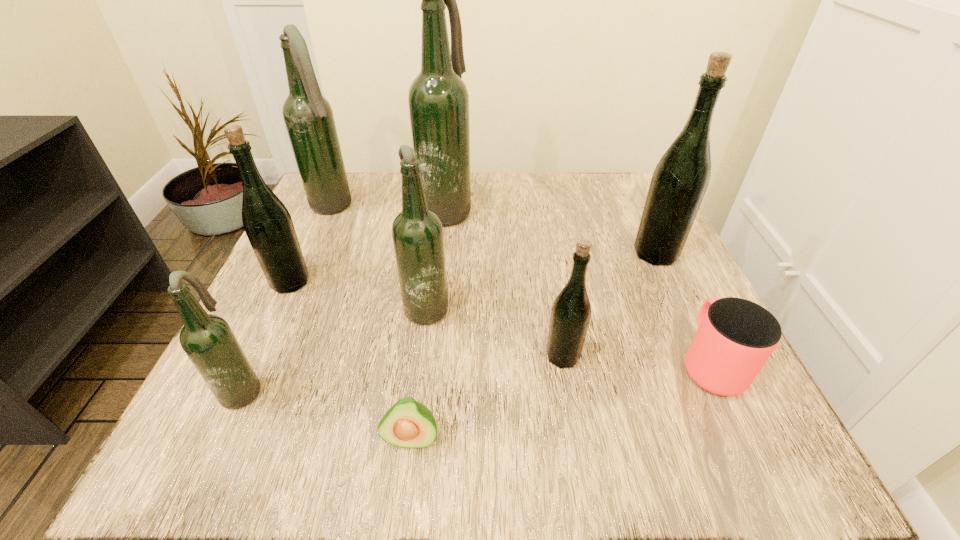
Where is `vacant region between the second nearest dark beer bottle and the leftmost green beer bottle`? vacant region between the second nearest dark beer bottle and the leftmost green beer bottle is located at coordinates (359, 293).

The height and width of the screenshot is (540, 960). In order to click on vacant point located between the smallest green beer bottle and the cup in this screenshot , I will do `click(636, 360)`.

Identify the location of unoccupied position between the green avocado and the smallest dark beer bottle. (327, 413).

Locate an element on the screen. Image resolution: width=960 pixels, height=540 pixels. free space between the fifth nearest beer bottle and the second biggest dark beer bottle is located at coordinates (494, 230).

You are a GUI agent. You are given a task and a screenshot of the screen. Output one action in this format:
    pyautogui.click(x=<x>, y=<y>)
    Task: Click on the empty space that is in between the nearest dark beer bottle and the nearest object
    The height and width of the screenshot is (540, 960).
    Given the screenshot: What is the action you would take?
    pyautogui.click(x=327, y=413)

Identify the location of blank region between the pink cup and the green avocado. The image size is (960, 540). (561, 401).

What are the coordinates of `the third closest object to the nearest object` in the screenshot? It's located at (208, 341).

Identify the location of the fifth closest object relative to the biggest dark beer bottle. The image size is (960, 540). (571, 311).

Where is `the second closest beer bottle to the third smallest dark beer bottle`? This screenshot has height=540, width=960. the second closest beer bottle to the third smallest dark beer bottle is located at coordinates (268, 225).

Choose which beer bottle is the nearest neighbor to the smallest dark beer bottle. Please provide its 2D coordinates. Your answer should be formatted as a tuple, i.e. [(x, y)], where the tuple contains the x and y coordinates of a point satisfying the conditions above.

[(268, 225)]